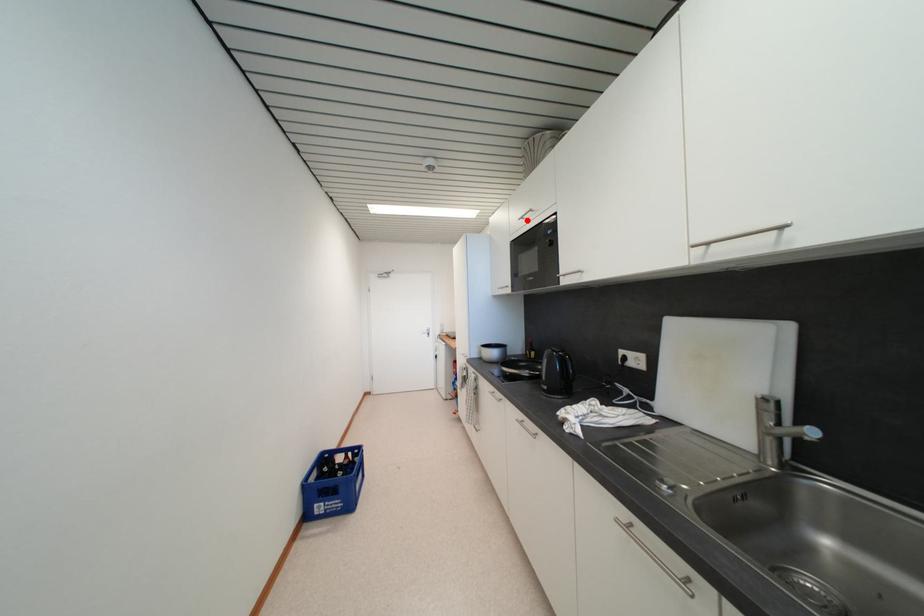
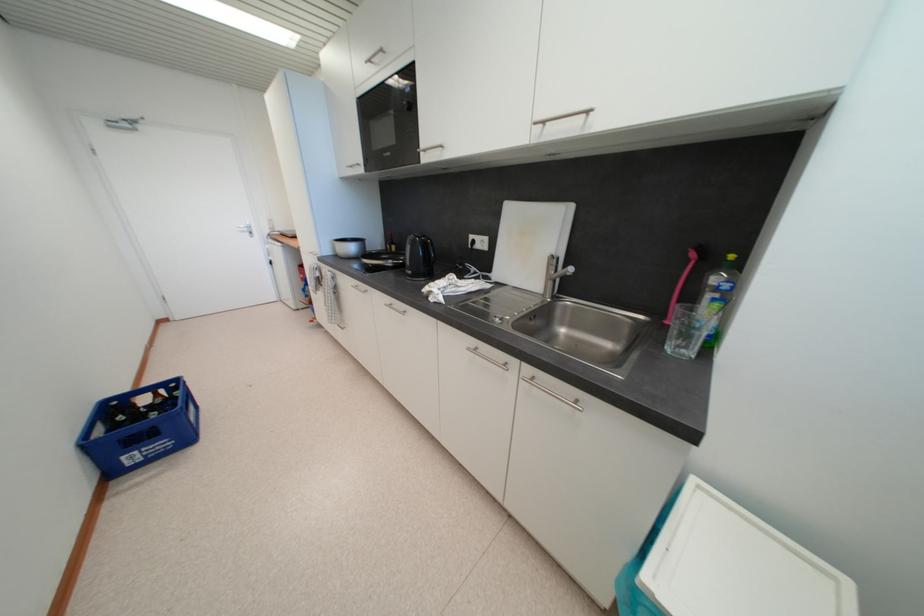
Question: I am providing you with two images of the same scene from different viewpoints. A red point is marked on the first image. Can you still see the location of the red point in image 2?

Choices:
 (A) Yes
 (B) No

Answer: (A)